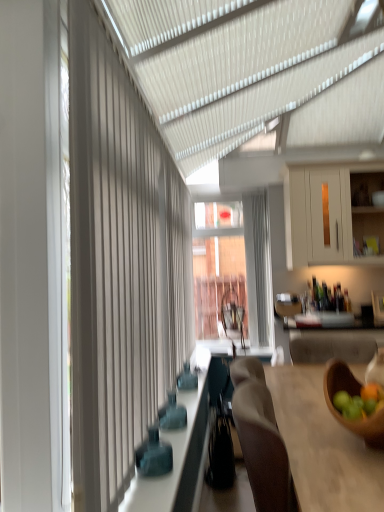
Identify the location of vacant space to the left of wooden bowl at lower right. This screenshot has height=512, width=384. (309, 449).